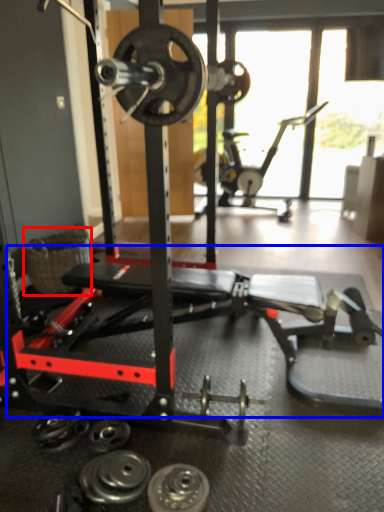
Question: Which object is closer to the camera taking this photo, basket (highlighted by a red box) or training bench (highlighted by a blue box)?

Choices:
 (A) basket
 (B) training bench

Answer: (B)